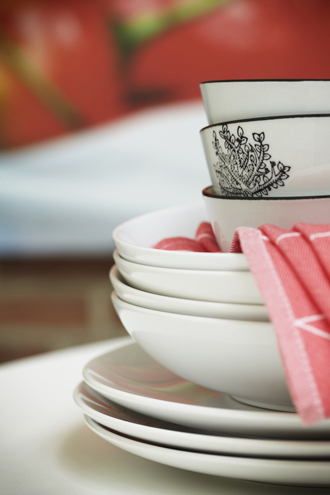
Locate an element on the screen. Image resolution: width=330 pixels, height=495 pixels. dish is located at coordinates (164, 463), (173, 435), (189, 417), (210, 350), (201, 302), (208, 282), (206, 255), (233, 213), (264, 160), (265, 104).